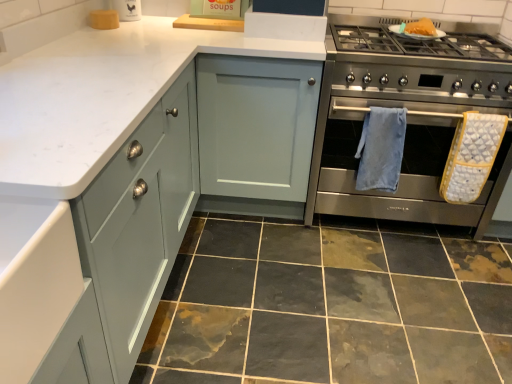
This screenshot has height=384, width=512. What are the coordinates of `free spot above white marble countertop at upper left (from a real-world perspective)` in the screenshot? It's located at (187, 35).